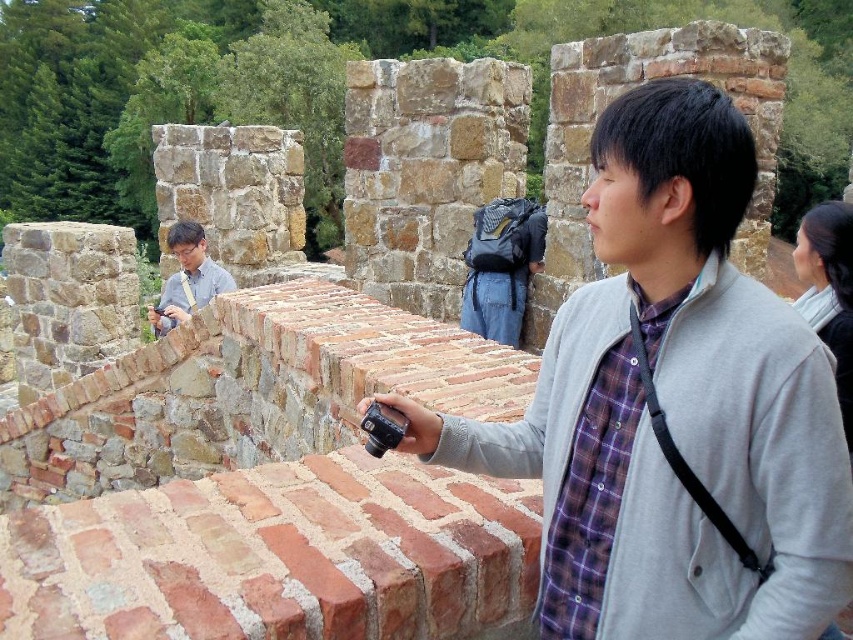
You are a photographer standing in front of an old stone structure. You notice a gray matte jacket at center and a matte gray shirt at center. Which clothing item is higher up on your body?

The gray matte jacket at center is taller than the matte gray shirt at center, so the jacket is higher up on the body.

You are a photographer trying to adjust your camera settings. You notice two gray items at the center of your viewfinder. Which one is closer to the camera lens between the gray matte jacket at center and the matte gray shirt at center?

The gray matte jacket at center is below the matte gray shirt at center, so the matte gray shirt at center is closer to the camera lens.

You are a photographer standing in front of the stone structure. You are wearing a gray matte jacket at center and a matte gray shirt at center. Which clothing item is wider when viewed from the front?

The gray matte jacket at center is wider than the matte gray shirt at center according to the description.